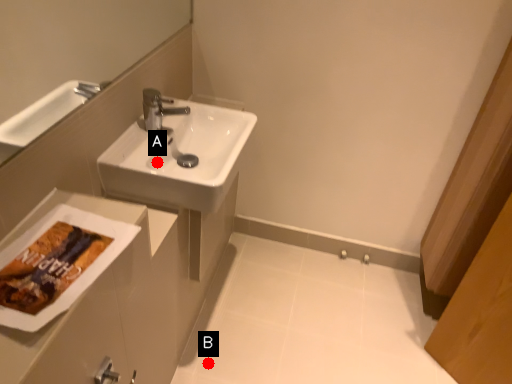
Question: Two points are circled on the image, labeled by A and B beside each circle. Which of the following is the closest to the observer?

Choices:
 (A) A is closer
 (B) B is closer

Answer: (A)